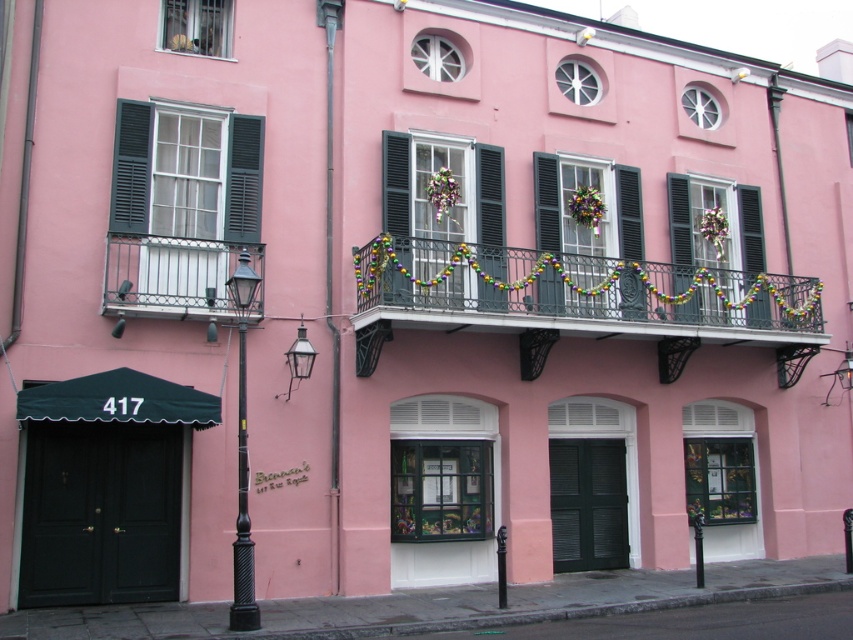
Question: Which point appears closest to the camera in this image?

Choices:
 (A) (584, 186)
 (B) (225, 237)
 (C) (688, 195)

Answer: (B)

Question: Does metallic wrought iron balcony at center appear under white wrought iron balcony at center?

Choices:
 (A) yes
 (B) no

Answer: (A)

Question: Considering the relative positions of black matte shutter at center and multicolored fabric wreath at center in the image provided, where is black matte shutter at center located with respect to multicolored fabric wreath at center?

Choices:
 (A) right
 (B) left

Answer: (B)

Question: Which object is farther from the camera taking this photo?

Choices:
 (A) metallic wrought iron balcony at center
 (B) black matte shutters at upper left

Answer: (A)

Question: Considering the relative positions of black matte shutter at center and green matte shutter at center in the image provided, where is black matte shutter at center located with respect to green matte shutter at center?

Choices:
 (A) left
 (B) right

Answer: (A)

Question: Which point is closer to the camera?

Choices:
 (A) green matte shutter at center
 (B) white wrought iron balcony at center

Answer: (B)